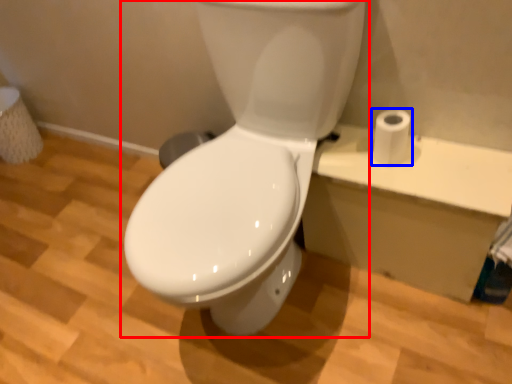
Question: Among these objects, which one is nearest to the camera, toilet (highlighted by a red box) or toilet paper (highlighted by a blue box)?

Choices:
 (A) toilet
 (B) toilet paper

Answer: (A)